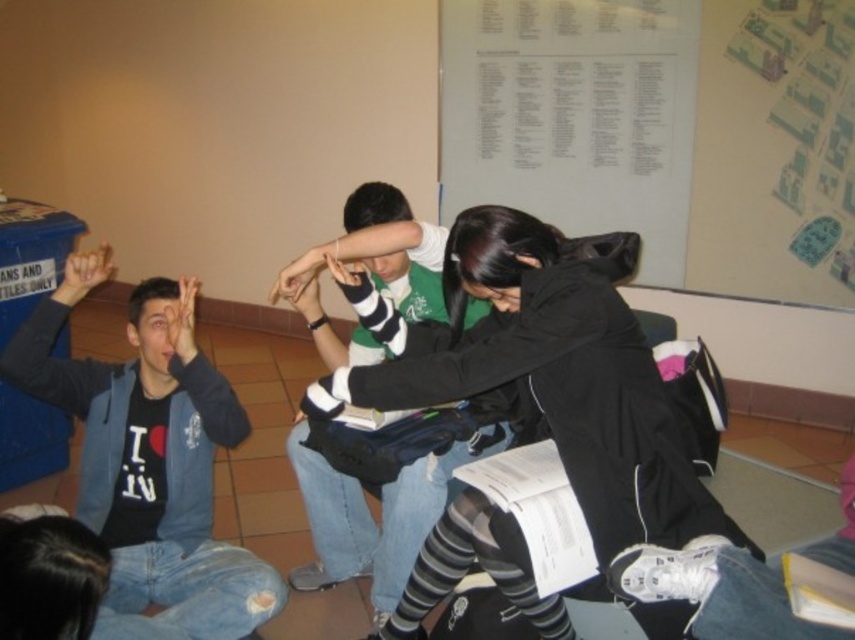
Between matte blue hoodie at left and matte black hand at upper left, which one is positioned higher?

matte black hand at upper left

Does matte blue hoodie at left have a larger size compared to matte black hand at upper left?

Yes.

Does point (240, 408) come closer to viewer compared to point (171, 346)?

No, (240, 408) is further to viewer.

Where is `matte blue hoodie at left`? matte blue hoodie at left is located at coordinates (148, 465).

Between black matte jacket at center and matte blue hoodie at left, which one appears on the right side from the viewer's perspective?

black matte jacket at center is more to the right.

Does black matte jacket at center appear under matte blue hoodie at left?

No, black matte jacket at center is not below matte blue hoodie at left.

Which is behind, point (517, 374) or point (204, 385)?

The point (204, 385) is behind.

In order to click on black matte jacket at center in this screenshot , I will do `click(549, 372)`.

Measure the distance between black matte jacket at center and matte black hand at upper left.

black matte jacket at center is 32.76 inches away from matte black hand at upper left.

Does point (700, 500) come behind point (186, 362)?

No, (700, 500) is closer to viewer.

Locate an element on the screen. Image resolution: width=855 pixels, height=640 pixels. black matte jacket at center is located at coordinates (549, 372).